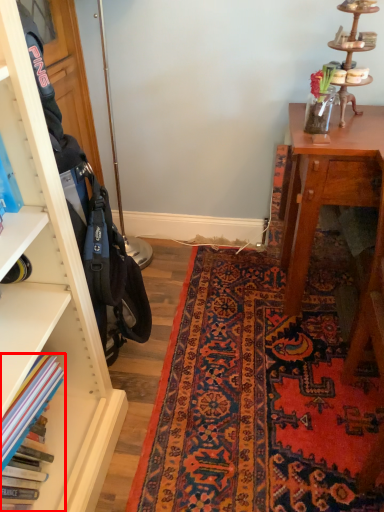
Question: Where is book (annotated by the red box) located in relation to mat in the image?

Choices:
 (A) left
 (B) right

Answer: (A)